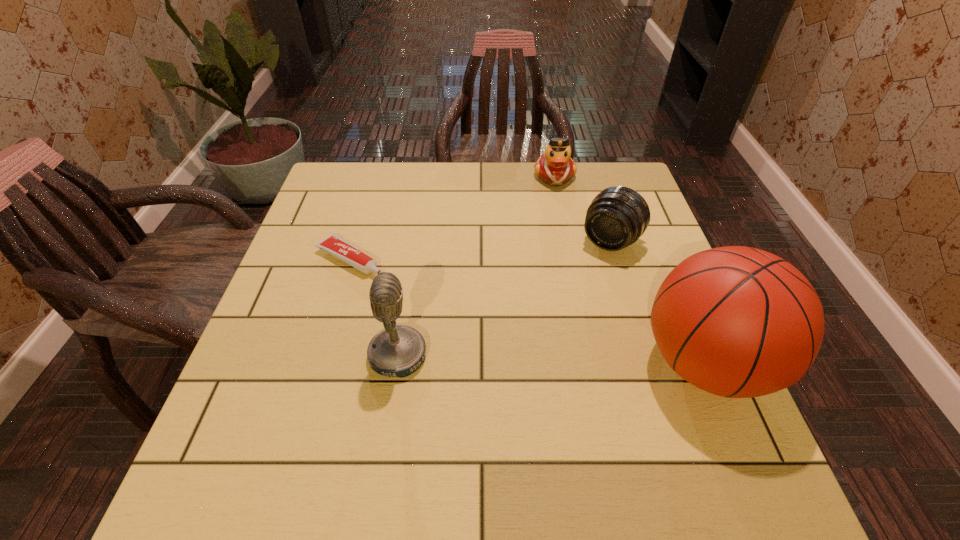
The height and width of the screenshot is (540, 960). In order to click on the fourth shortest object in this screenshot , I will do `click(397, 351)`.

You are a GUI agent. You are given a task and a screenshot of the screen. Output one action in this format:
    pyautogui.click(x=<x>, y=<y>)
    Task: Click on the second object from left to right
    The height and width of the screenshot is (540, 960).
    Given the screenshot: What is the action you would take?
    pyautogui.click(x=397, y=351)

Identify the location of the tallest object. This screenshot has width=960, height=540. (739, 322).

I want to click on toothpaste, so click(x=333, y=244).

Locate an element on the screen. The width and height of the screenshot is (960, 540). the shortest object is located at coordinates (333, 244).

Find the location of a particular element. telephoto lens is located at coordinates (616, 218).

Find the location of a particular element. This screenshot has height=540, width=960. duck is located at coordinates (555, 167).

Locate an element on the screen. The height and width of the screenshot is (540, 960). vacant space located on the front-facing side of the microphone is located at coordinates (466, 355).

Locate an element on the screen. vacant area located on the back of the tallest object is located at coordinates (661, 260).

Locate an element on the screen. blank space located at the nozzle of the toothpaste is located at coordinates tap(396, 284).